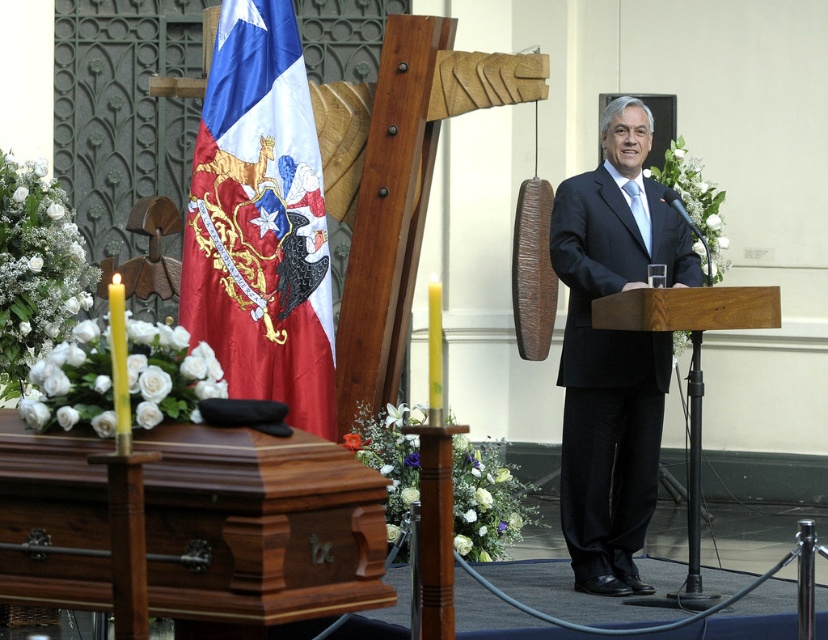
Can you confirm if polished wood casket at center is positioned above matte black suit at center?

No, polished wood casket at center is not above matte black suit at center.

Consider the image. Is polished wood casket at center behind matte black suit at center?

No, it is not.

At what (x,y) coordinates should I click in order to perform the action: click on polished wood casket at center. Please return your answer as a coordinate pair (x, y). Looking at the image, I should click on (258, 531).

Is matte black suit at center above wooden podium at center?

Correct, matte black suit at center is located above wooden podium at center.

Which of these two, matte black suit at center or wooden podium at center, stands taller?

With more height is matte black suit at center.

At what (x,y) coordinates should I click in order to perform the action: click on matte black suit at center. Please return your answer as a coordinate pair (x, y). Looking at the image, I should click on click(x=614, y=349).

Between point (148, 608) and point (234, 42), which one is positioned behind?

Positioned behind is point (234, 42).

I want to click on polished wood casket at center, so click(x=258, y=531).